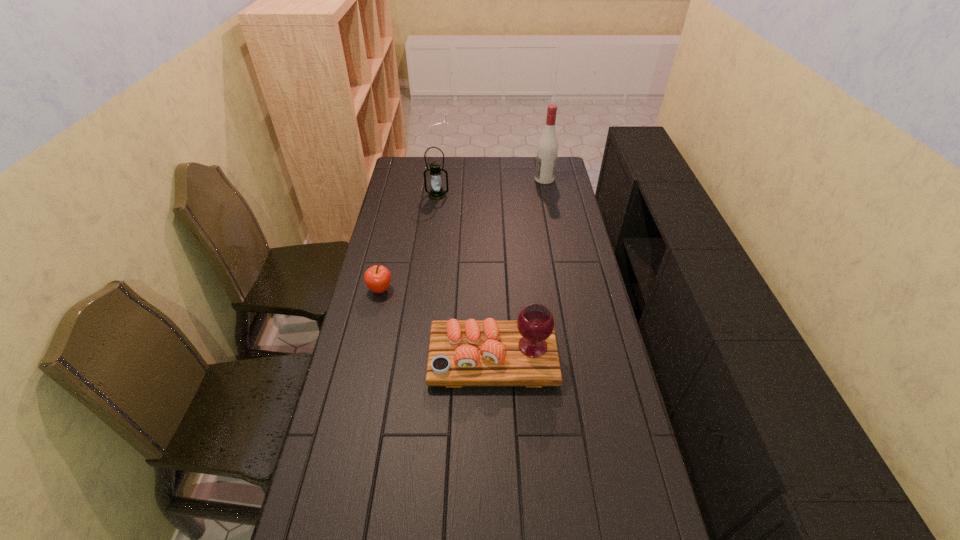
The image size is (960, 540). What are the coordinates of `vacant position at the right edge of the desktop` in the screenshot? It's located at (592, 375).

The width and height of the screenshot is (960, 540). Identify the location of free spot at the far left corner of the desktop. (398, 169).

At what (x,y) coordinates should I click in order to perform the action: click on vacant region between the third shortest object and the platter. Please return your answer as a coordinate pair (x, y). Looking at the image, I should click on (465, 276).

Locate an element on the screen. vacant space that is in between the leftmost object and the farthest object is located at coordinates (463, 234).

Where is `vacant space in between the lantern and the platter`? vacant space in between the lantern and the platter is located at coordinates (465, 276).

Where is `vacant space that's between the third shortest object and the third farthest object`? Image resolution: width=960 pixels, height=540 pixels. vacant space that's between the third shortest object and the third farthest object is located at coordinates click(x=409, y=242).

Where is `free space between the lantern and the second shortest object`? The image size is (960, 540). free space between the lantern and the second shortest object is located at coordinates tap(465, 276).

The height and width of the screenshot is (540, 960). What are the coordinates of `free spot between the rightmost object and the second shortest object` in the screenshot? It's located at (518, 268).

Identify the location of vacant area that lies between the tallest object and the second shortest object. (518, 268).

Identify which object is located as the nearest to the second nearest object. Please provide its 2D coordinates. Your answer should be formatted as a tuple, i.e. [(x, y)], where the tuple contains the x and y coordinates of a point satisfying the conditions above.

[(461, 353)]